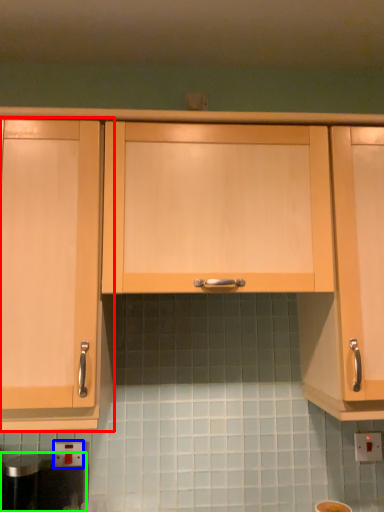
Question: Which object is positioned closest to cabinetry (highlighted by a red box)? Select from electric outlet (highlighted by a blue box) and appliance (highlighted by a green box).

Choices:
 (A) electric outlet
 (B) appliance

Answer: (B)